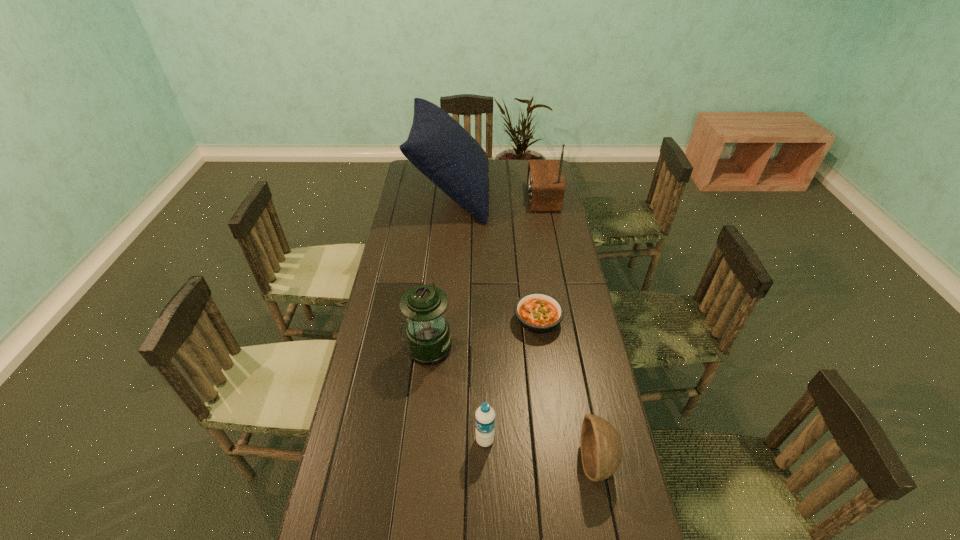
Image resolution: width=960 pixels, height=540 pixels. I want to click on free spot between the water bottle and the bowl, so coord(540,451).

Identify which object is the fifth nearest to the lantern. Please provide its 2D coordinates. Your answer should be formatted as a tuple, i.e. [(x, y)], where the tuple contains the x and y coordinates of a point satisfying the conditions above.

[(545, 183)]

Identify which object is the fourth nearest to the radio receiver. Please provide its 2D coordinates. Your answer should be formatted as a tuple, i.e. [(x, y)], where the tuple contains the x and y coordinates of a point satisfying the conditions above.

[(601, 448)]

Find the location of `free space that satisfies the following two spatial constraints: 1. on the facing side of the shortest object; 2. on the right side of the cushion`. free space that satisfies the following two spatial constraints: 1. on the facing side of the shortest object; 2. on the right side of the cushion is located at coordinates tap(442, 321).

What are the coordinates of `free location that satisfies the following two spatial constraints: 1. on the facing side of the cushion; 2. on the right side of the bowl` in the screenshot? It's located at (429, 462).

Where is `free spot that satisfies the following two spatial constraints: 1. on the front-facing side of the radio receiver; 2. on the left side of the bowl`? This screenshot has height=540, width=960. free spot that satisfies the following two spatial constraints: 1. on the front-facing side of the radio receiver; 2. on the left side of the bowl is located at coordinates (591, 462).

The height and width of the screenshot is (540, 960). I want to click on vacant area in the image that satisfies the following two spatial constraints: 1. on the back side of the bowl; 2. on the facing side of the cushion, so click(x=544, y=193).